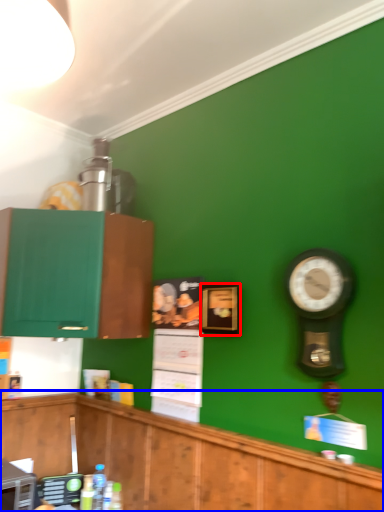
Question: Among these objects, which one is nearest to the camera, picture frame (highlighted by a red box) or cabinetry (highlighted by a blue box)?

Choices:
 (A) picture frame
 (B) cabinetry

Answer: (B)